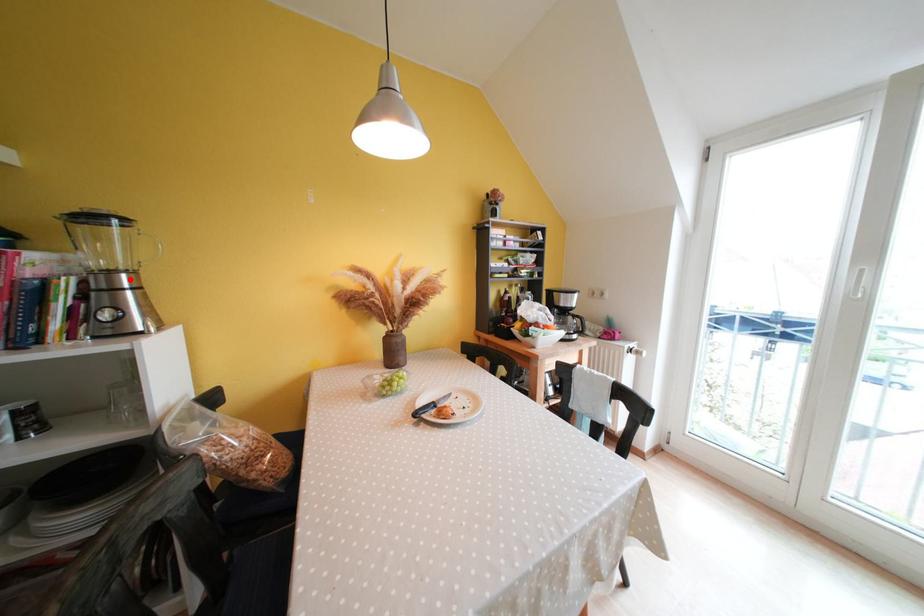
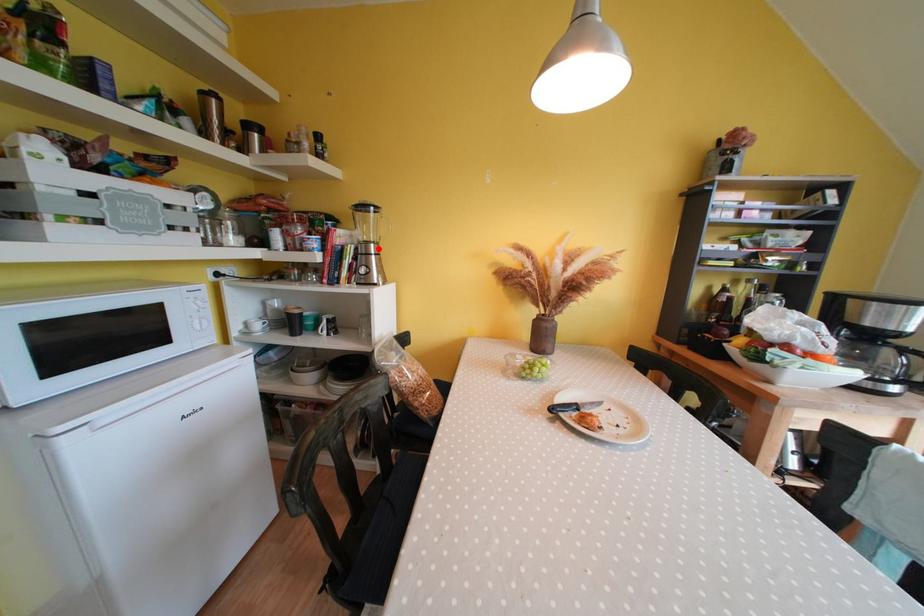
I am providing you with two images of the same scene from different viewpoints. A red point is marked on the first image and another point is marked on the second image. Does the point marked in image1 correspond to the same location as the one in image2?

Yes